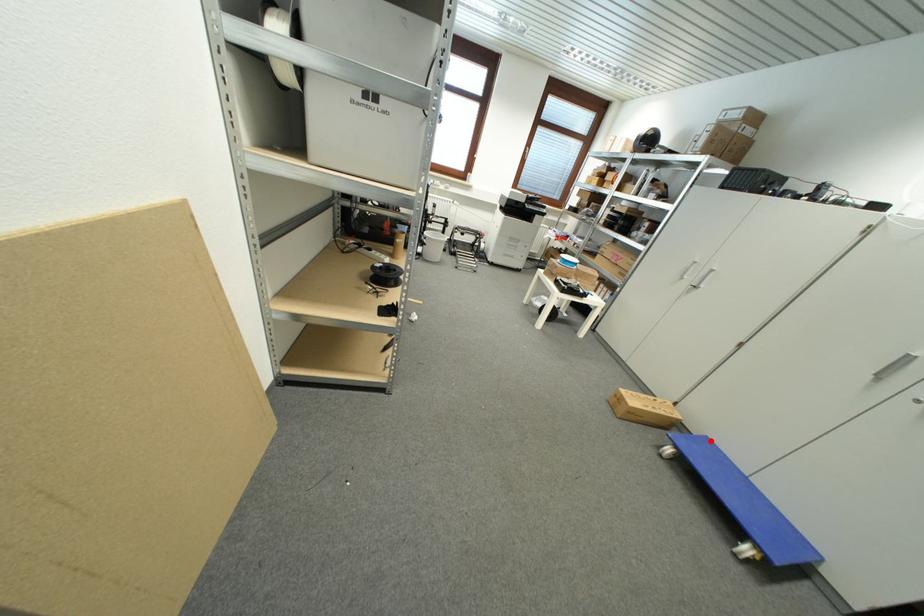
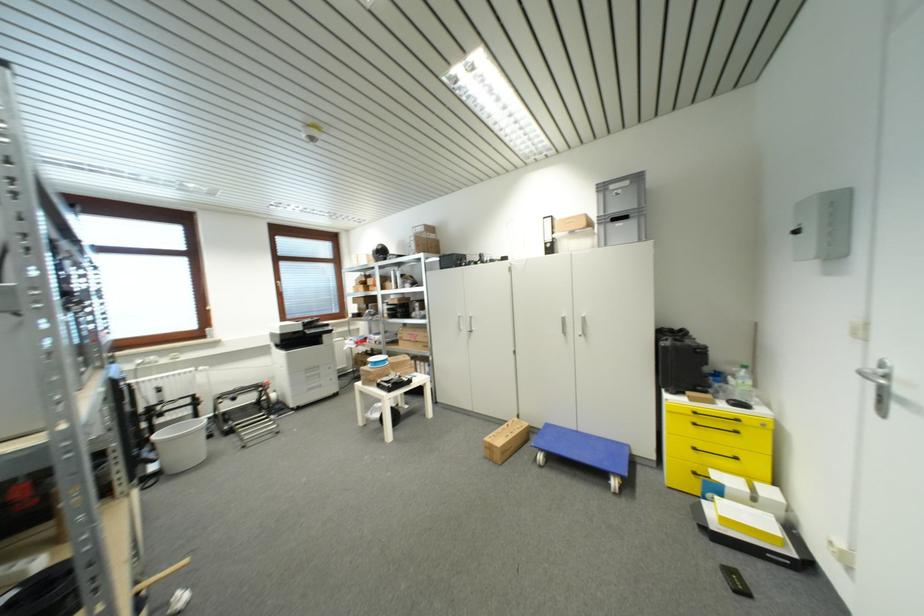
Locate, in the second image, the point that corresponds to the highlighted location in the first image.

(552, 427)